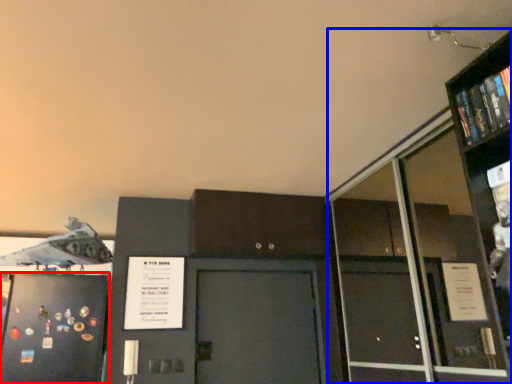
Question: Which of the following is the farthest to the observer, door (highlighted by a red box) or bookcase (highlighted by a blue box)?

Choices:
 (A) door
 (B) bookcase

Answer: (A)